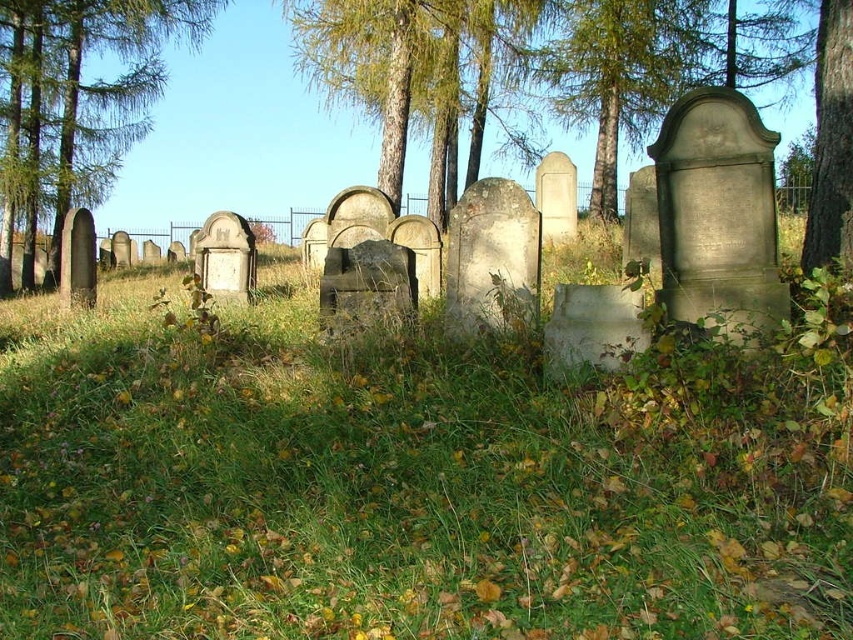
Question: Among these points, which one is nearest to the camera?

Choices:
 (A) (682, 12)
 (B) (126, 353)
 (C) (453, 81)
 (D) (77, 196)

Answer: (B)

Question: Can you confirm if green grassy at center is positioned below green textured tree at center?

Choices:
 (A) no
 (B) yes

Answer: (B)

Question: Can you confirm if green leafy tree at left is bigger than green bark tree at center?

Choices:
 (A) no
 (B) yes

Answer: (A)

Question: Can you confirm if green textured tree at center is positioned to the right of brown rough bark tree at right?

Choices:
 (A) yes
 (B) no

Answer: (B)

Question: Which of the following is the closest to the observer?

Choices:
 (A) green grassy at center
 (B) green textured tree at center

Answer: (A)

Question: Which point is closer to the camera taking this photo?

Choices:
 (A) (592, 209)
 (B) (103, 136)

Answer: (A)